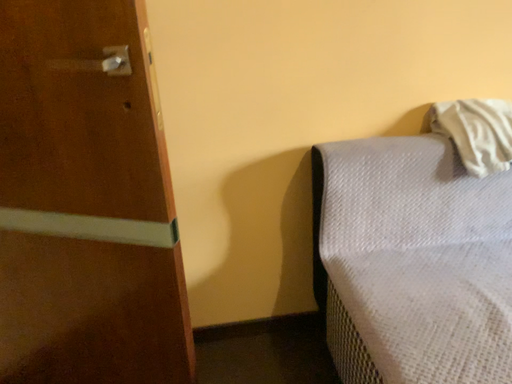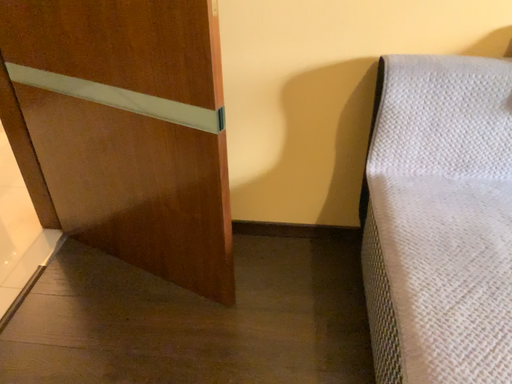
Question: Which way did the camera rotate in the video?

Choices:
 (A) rotated right
 (B) rotated left

Answer: (B)